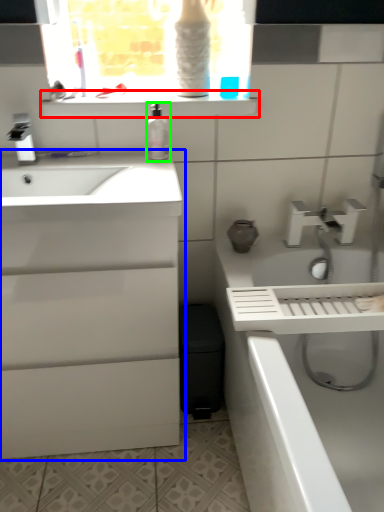
Question: Which is farther away from window sill (highlighted by a red box)? bathroom cabinet (highlighted by a blue box) or soap dispenser (highlighted by a green box)?

Choices:
 (A) bathroom cabinet
 (B) soap dispenser

Answer: (A)